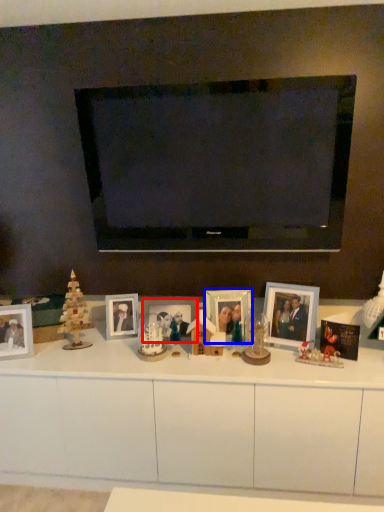
Question: Which object is further to the camera taking this photo, picture frame (highlighted by a red box) or picture frame (highlighted by a blue box)?

Choices:
 (A) picture frame
 (B) picture frame

Answer: (A)